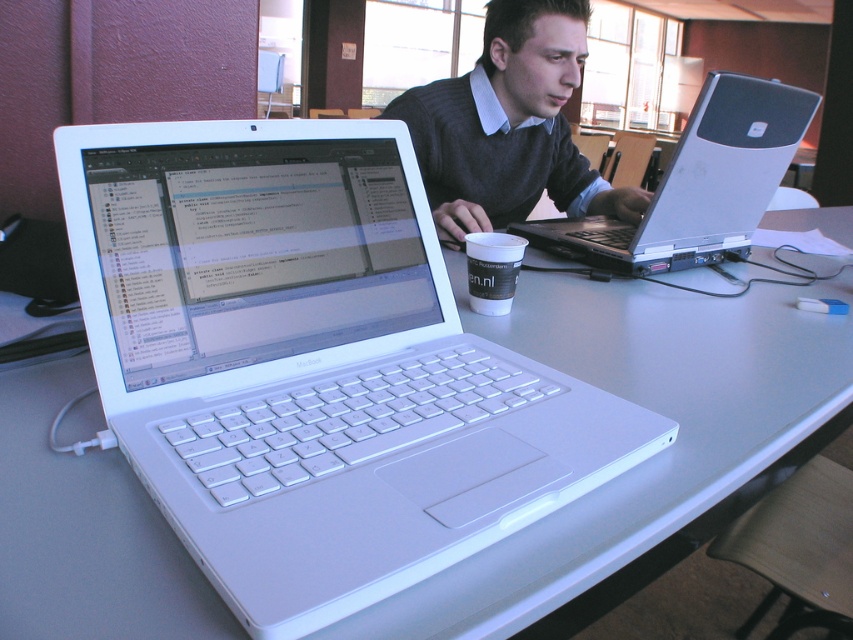
You are a delivery person who needs to place a small package between the dark gray sweater at center and the silver metallic laptop at center. The package is 10 inches long. Will it fit in the space between them?

The dark gray sweater at center is 9.05 inches from the silver metallic laptop at center. Since the package is 10 inches long, it is slightly longer than the available space. Therefore, the package will not fit between them.

You need to place a rectangular box that is 12 inches wide on the table. The dark gray sweater at center and the silver metallic laptop at center are on the table. Based on their widths, can you determine if the box will fit between them without moving either object?

The dark gray sweater at center might be wider than the silver metallic laptop at center, so the box may not fit between them if the sweater is wider. However, since the exact widths are not provided, it is uncertain. Please check the actual dimensions.